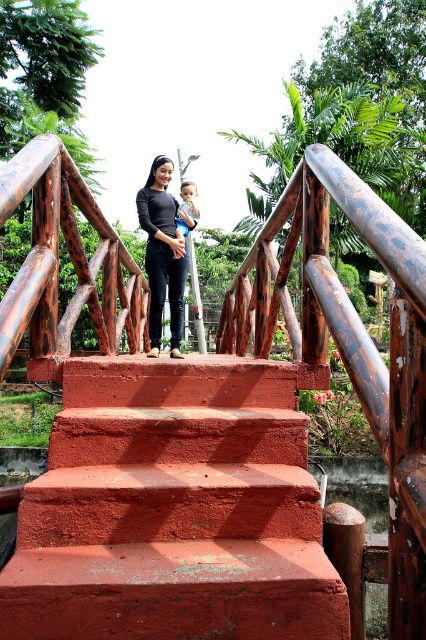
You are a photographer trying to capture the smooth red concrete stairs at center and the smooth skin baby at center in a single shot. Which object should you focus on first if you want to ensure both are in frame without moving the camera?

The smooth red concrete stairs at center is smaller than the smooth skin baby at center, so you should focus on the smooth skin baby at center first to ensure it fits within the frame while keeping the stairs visible.